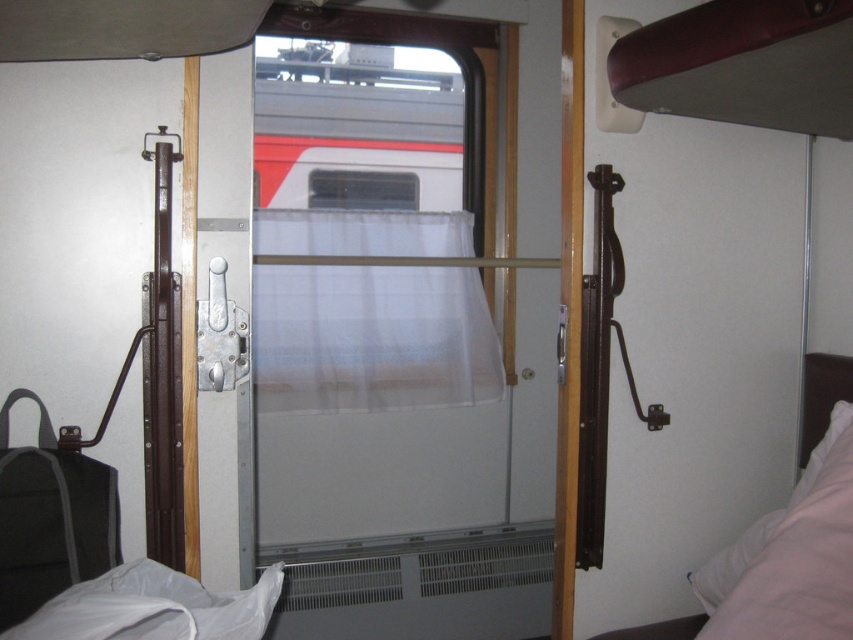
Question: Which point appears farthest from the camera in this image?

Choices:
 (A) (831, 369)
 (B) (332, 202)
 (C) (838, 593)

Answer: (B)

Question: Based on their relative distances, which object is nearer to the white soft pillow at lower right?

Choices:
 (A) transparent plastic window at center
 (B) white sheer curtain at center

Answer: (B)

Question: Can you confirm if white sheer curtain at center is thinner than white soft pillow at lower right?

Choices:
 (A) yes
 (B) no

Answer: (B)

Question: Which object appears closest to the camera in this image?

Choices:
 (A) white sheer curtain at center
 (B) transparent plastic window at center

Answer: (A)

Question: Is white sheer curtain at center smaller than white soft bed at right?

Choices:
 (A) yes
 (B) no

Answer: (B)

Question: Is white soft bed at right positioned in front of transparent plastic window at center?

Choices:
 (A) no
 (B) yes

Answer: (B)